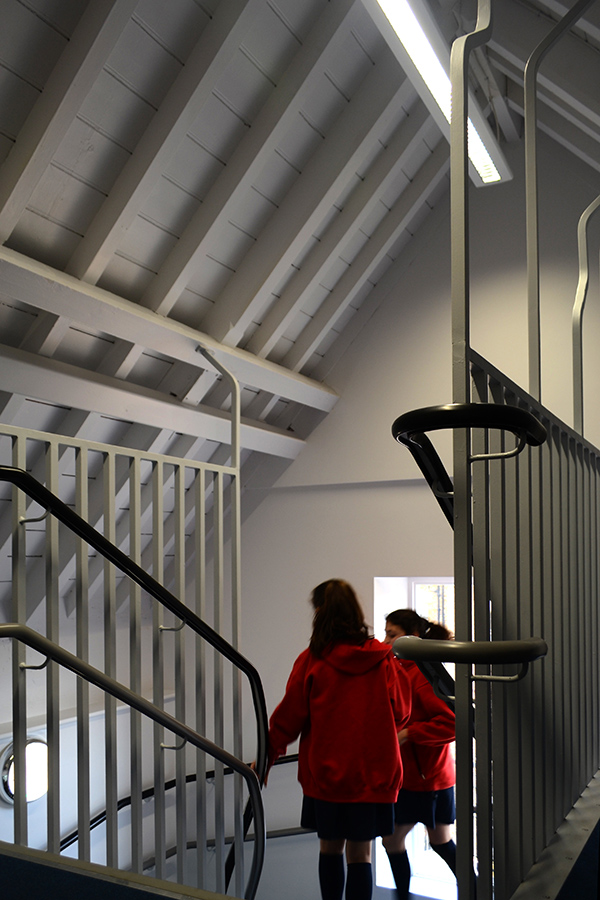
The height and width of the screenshot is (900, 600). I want to click on wall, so click(288, 570).